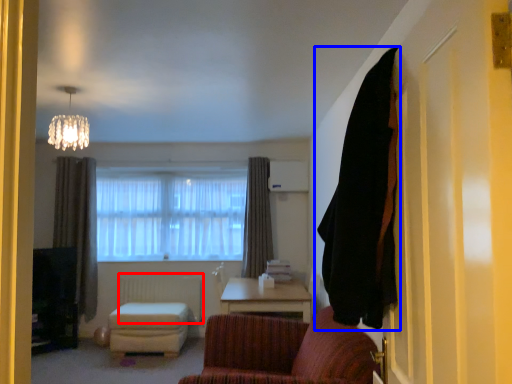
Question: Which point is closer to the camera, radiator (highlighted by a red box) or curtain (highlighted by a blue box)?

Choices:
 (A) radiator
 (B) curtain

Answer: (B)